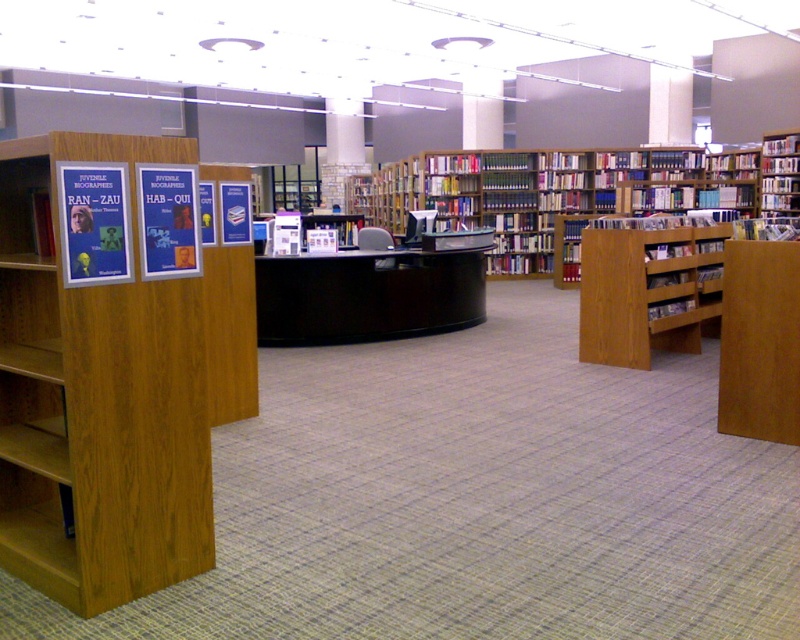
Based on the photo, you are a library visitor holding a book and want to place it on the blue paper poster at left. Can you place the book directly on the poster without moving the wooden bookcase at center?

The blue paper poster at left is behind the wooden bookcase at center, so you cannot place the book directly on the poster without moving the wooden bookcase at center.